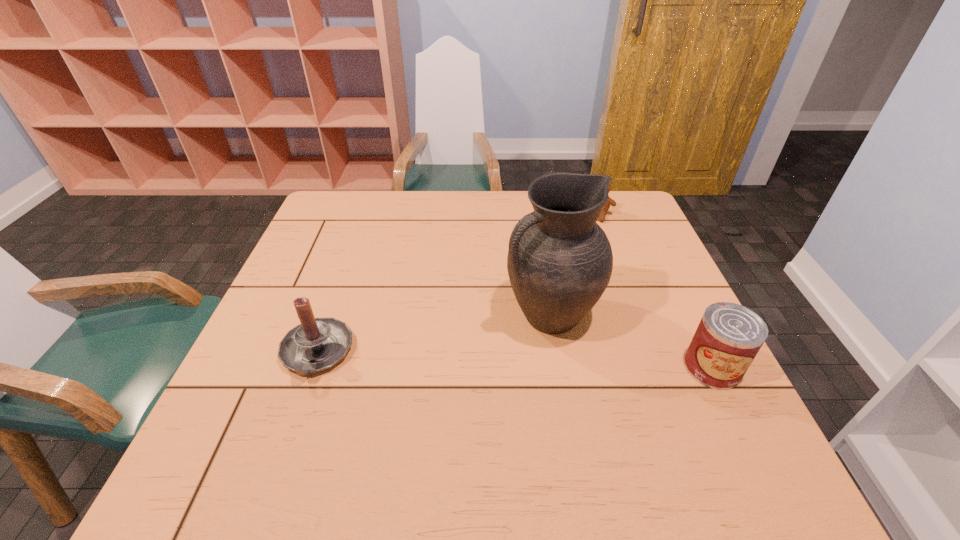
I want to click on vacant space at the near edge of the desktop, so click(372, 406).

Locate an element on the screen. This screenshot has height=540, width=960. vacant space at the left edge of the desktop is located at coordinates (314, 266).

Where is `vacant space at the right edge of the desktop`? The width and height of the screenshot is (960, 540). vacant space at the right edge of the desktop is located at coordinates (628, 310).

Image resolution: width=960 pixels, height=540 pixels. Identify the location of vacant space at the far left corner of the desktop. (357, 229).

At what (x,y) coordinates should I click in order to perform the action: click on free space at the far right corner of the desktop. Please return your answer as a coordinate pair (x, y). Looking at the image, I should click on (645, 232).

This screenshot has width=960, height=540. Identify the location of vacant region at the near right corner of the desktop. (719, 414).

The height and width of the screenshot is (540, 960). What are the coordinates of `vacant area that lies between the rightmost object and the pitcher` in the screenshot? It's located at (631, 342).

The image size is (960, 540). Identify the location of vacant area that lies between the tallest object and the can. (631, 342).

You are a GUI agent. You are given a task and a screenshot of the screen. Output one action in this format:
    pyautogui.click(x=<x>, y=<y>)
    Task: Click on the free space between the third object from left to right and the leftmost object
    The height and width of the screenshot is (540, 960).
    Given the screenshot: What is the action you would take?
    pyautogui.click(x=458, y=285)

You are a GUI agent. You are given a task and a screenshot of the screen. Output one action in this format:
    pyautogui.click(x=<x>, y=<y>)
    Task: Click on the empty space between the rightmost object and the pitcher
    
    Given the screenshot: What is the action you would take?
    [x=631, y=342]